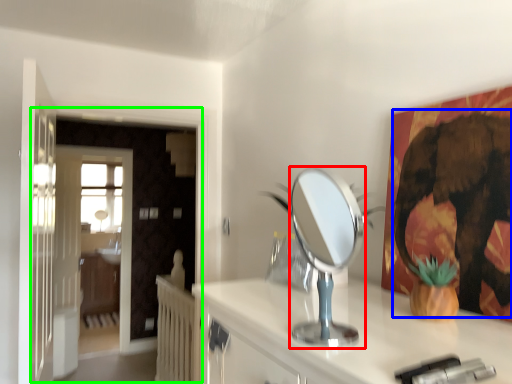
Question: Estimate the real-world distances between objects in this image. Which object is farther from mirror (highlighted by a red box), elephant (highlighted by a blue box) or door (highlighted by a green box)?

Choices:
 (A) elephant
 (B) door

Answer: (B)